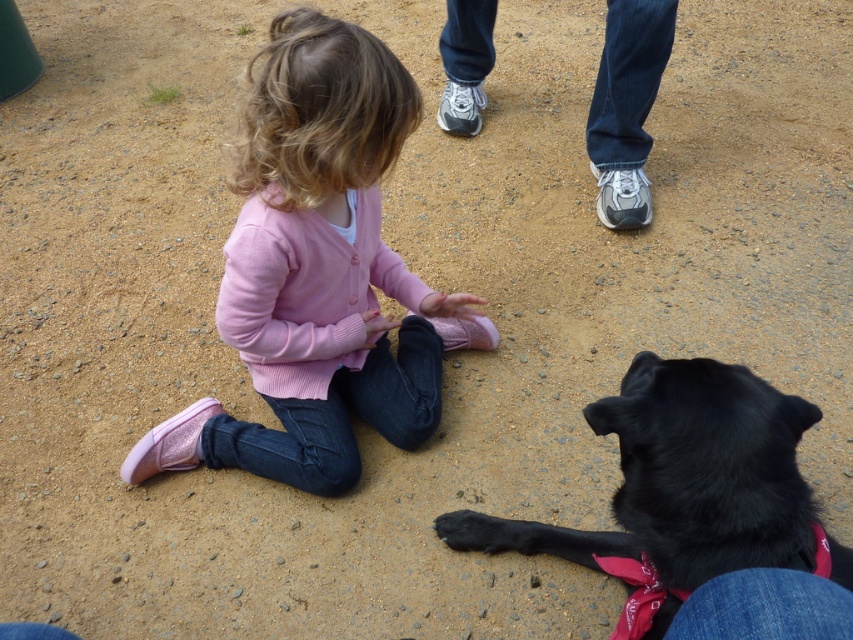
You are a photographer trying to capture a photo of the black fur dog at lower right and the pink matte sweater at center. Based on their heights, which one should you focus on first if you want to ensure both are in focus?

The pink matte sweater at center is taller than the black fur dog at lower right, so you should focus on the pink matte sweater at center first to ensure both are in focus.

What are the coordinates of the pink matte sweater at center?

The pink matte sweater at center is located at point (318, 269).

You are a photographer trying to capture a closeup of the black fur dog at lower right. You notice the pink matte sweater at center is blocking your view. Can you estimate whether the sweater is wider than the dog, making it harder to avoid?

The pink matte sweater at center might be wider than black fur dog at lower right, so there is a possibility that the sweater is blocking the view more due to its width.